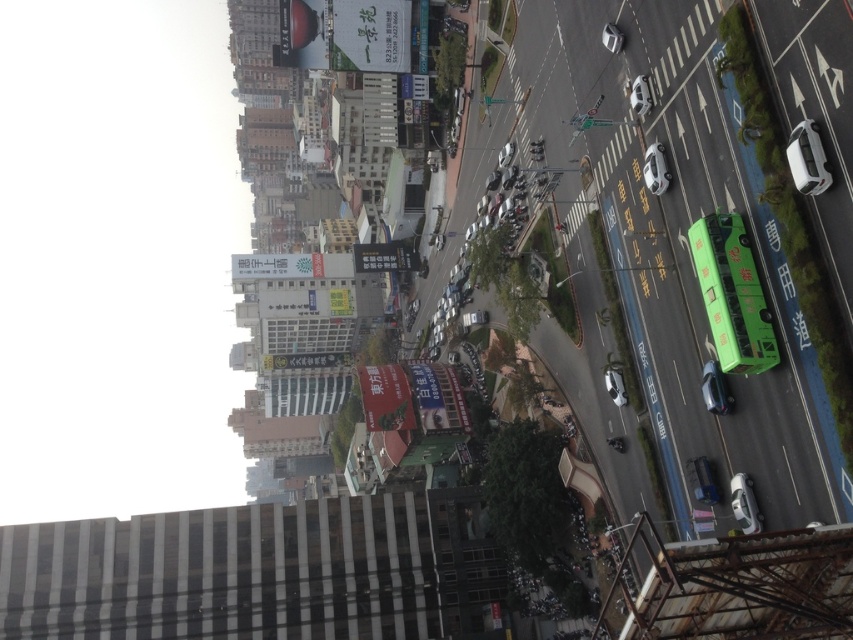
Can you confirm if white matte car at upper right is positioned below shiny silver car at right?

Actually, white matte car at upper right is above shiny silver car at right.

Does white matte car at upper right have a greater width compared to shiny silver car at right?

Incorrect, white matte car at upper right's width does not surpass shiny silver car at right's.

Is point (814, 131) farther from viewer compared to point (715, 384)?

That is False.

What are the coordinates of `white matte car at upper right` in the screenshot? It's located at (807, 160).

Can you confirm if white glossy car at lower right is thinner than shiny silver car at right?

Indeed, white glossy car at lower right has a lesser width compared to shiny silver car at right.

This screenshot has height=640, width=853. I want to click on white glossy car at lower right, so click(744, 504).

Which is more to the left, shiny silver car at right or white glossy car at upper right?

white glossy car at upper right is more to the left.

In the scene shown: Is shiny silver car at right positioned before white glossy car at upper right?

That is True.

Between point (724, 413) and point (648, 83), which one is positioned in front?

Point (724, 413)

You are a GUI agent. You are given a task and a screenshot of the screen. Output one action in this format:
    pyautogui.click(x=<x>, y=<y>)
    Task: Click on the shiny silver car at right
    The width and height of the screenshot is (853, 640).
    Given the screenshot: What is the action you would take?
    pyautogui.click(x=715, y=388)